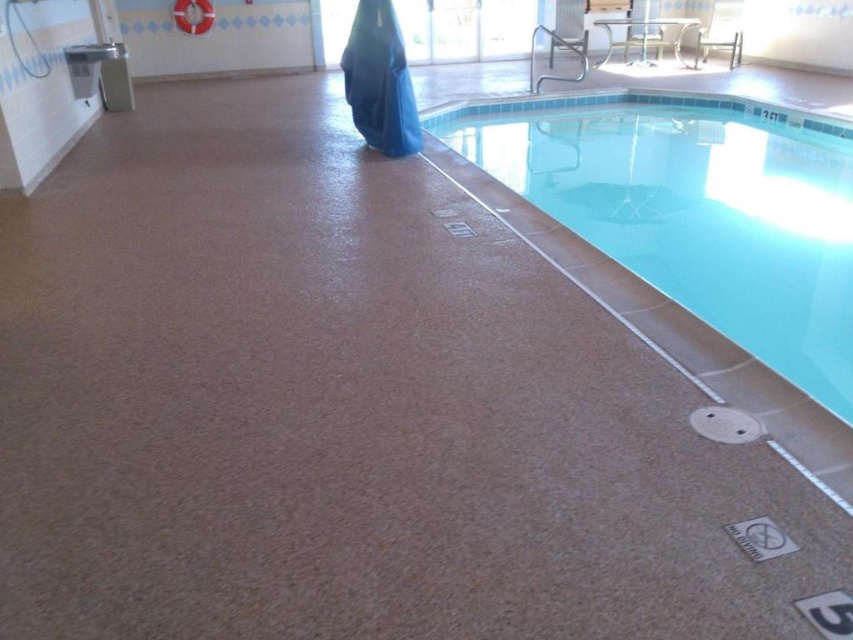
Who is shorter, smooth tile pool at center or blue fabric robe at upper center?

blue fabric robe at upper center is shorter.

Does smooth tile pool at center have a lesser height compared to blue fabric robe at upper center?

No, smooth tile pool at center is not shorter than blue fabric robe at upper center.

Who is more forward, (605, 154) or (345, 83)?

Point (345, 83) is more forward.

Find the location of a particular element. This screenshot has width=853, height=640. smooth tile pool at center is located at coordinates (695, 209).